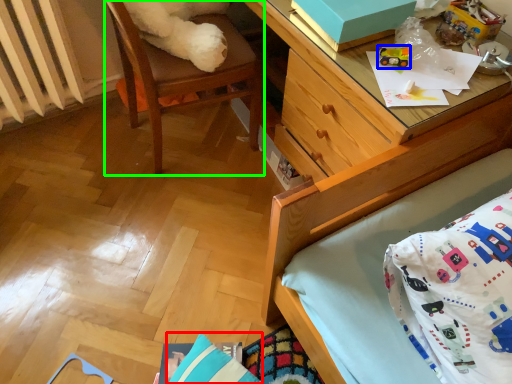
Question: Which is farther away from pillow (highlighted by a red box)? toy (highlighted by a blue box) or chair (highlighted by a green box)?

Choices:
 (A) toy
 (B) chair

Answer: (A)